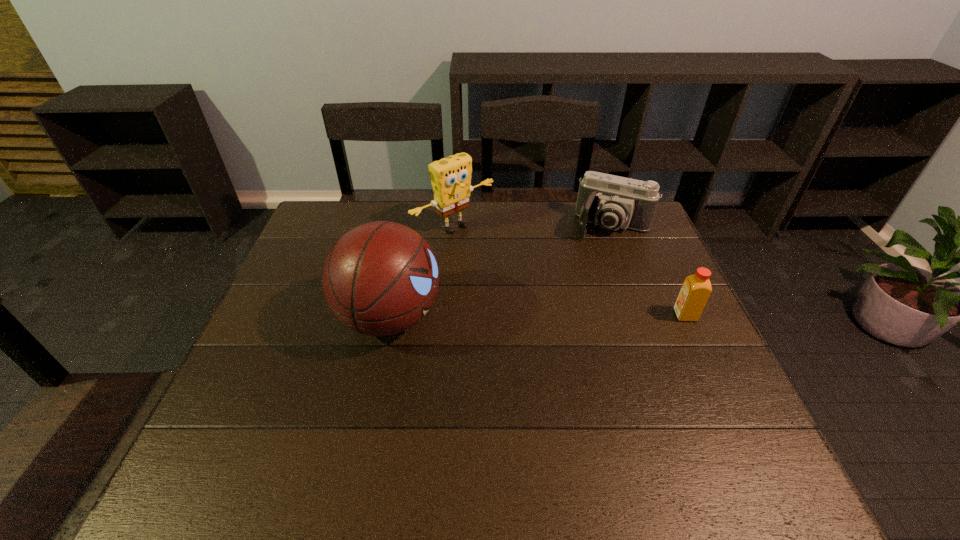
Find the location of a particular element. The width and height of the screenshot is (960, 540). blank space that satisfies the following two spatial constraints: 1. on the front side of the orange juice; 2. on the front and back of the sponge is located at coordinates (447, 315).